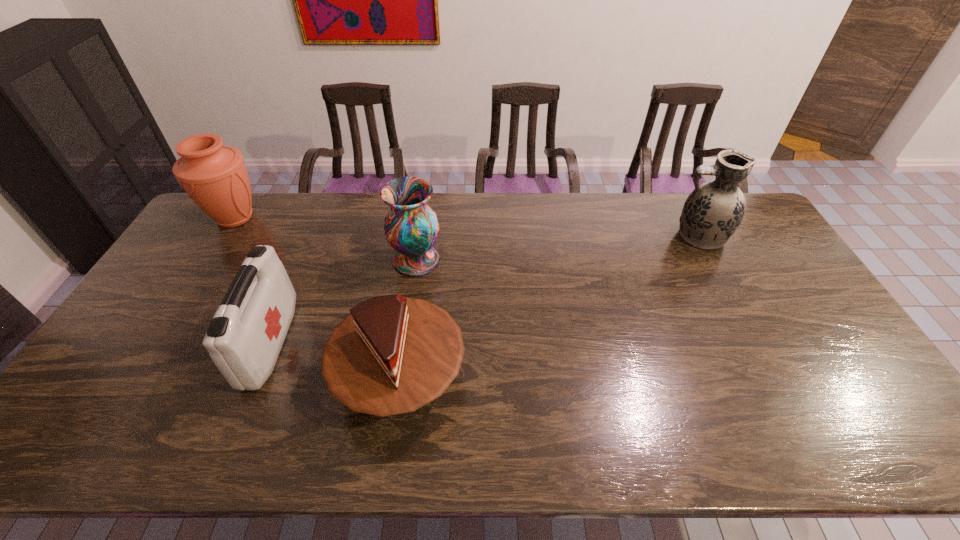
Locate an element on the screen. The height and width of the screenshot is (540, 960). vacant area at the right edge is located at coordinates (824, 351).

This screenshot has width=960, height=540. In the image, there is a desktop. Find the location of `vacant area at the near left corner`. vacant area at the near left corner is located at coordinates (84, 426).

Find the location of a particular element. free space that is in between the cake and the leftmost vase is located at coordinates (318, 299).

Where is `vacant area that lies between the cake and the leftmost object`? This screenshot has width=960, height=540. vacant area that lies between the cake and the leftmost object is located at coordinates coord(318,299).

In order to click on vacant area that lies between the leftmost object and the second vase from right to left in this screenshot , I will do `click(325, 239)`.

Locate an element on the screen. empty location between the first-aid kit and the second vase from right to left is located at coordinates (344, 302).

Where is `unoccupied position between the leftmost object and the cake`? The height and width of the screenshot is (540, 960). unoccupied position between the leftmost object and the cake is located at coordinates (318, 299).

Locate an element on the screen. The height and width of the screenshot is (540, 960). free area in between the second vase from left to right and the first-aid kit is located at coordinates (344, 302).

Where is `free space between the second vase from left to right and the leftmost vase`? This screenshot has height=540, width=960. free space between the second vase from left to right and the leftmost vase is located at coordinates (325, 239).

The width and height of the screenshot is (960, 540). Identify the location of object that can be found as the fourth closest to the cake. (713, 211).